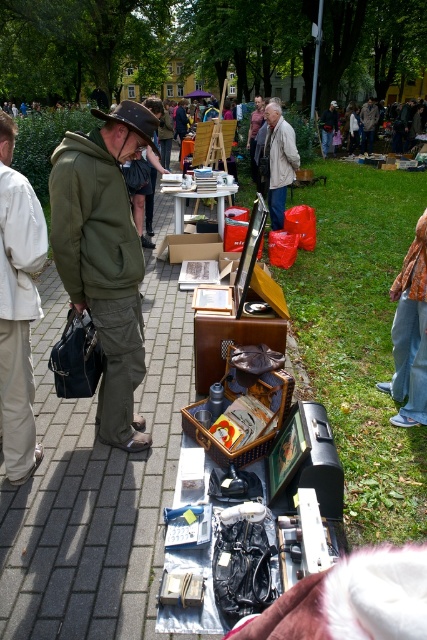
Is olive green hoodie at left positioned before light beige cotton pants at left?

No.

Where is `olive green hoodie at left`? The image size is (427, 640). olive green hoodie at left is located at coordinates (91, 221).

Identify the location of olive green hoodie at left. (91, 221).

Does matte green jacket at left have a lesser height compared to light beige cotton pants at left?

No.

Identify the location of matte green jacket at left. The image size is (427, 640). (105, 257).

Find the location of a particular element. The width and height of the screenshot is (427, 640). matte green jacket at left is located at coordinates (105, 257).

Is matte green jacket at left further to camera compared to light beige jacket at center?

That is False.

Who is higher up, matte green jacket at left or light beige jacket at center?

light beige jacket at center is above.

This screenshot has height=640, width=427. Describe the element at coordinates (105, 257) in the screenshot. I see `matte green jacket at left` at that location.

Image resolution: width=427 pixels, height=640 pixels. Find the location of `matte green jacket at left`. matte green jacket at left is located at coordinates pyautogui.click(x=105, y=257).